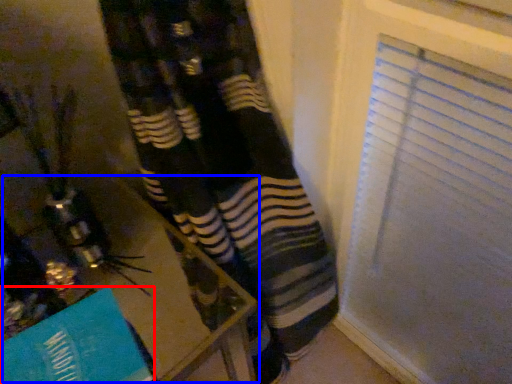
Question: Which of the following is the closest to the observer, paperback book (highlighted by a red box) or table (highlighted by a blue box)?

Choices:
 (A) paperback book
 (B) table

Answer: (A)